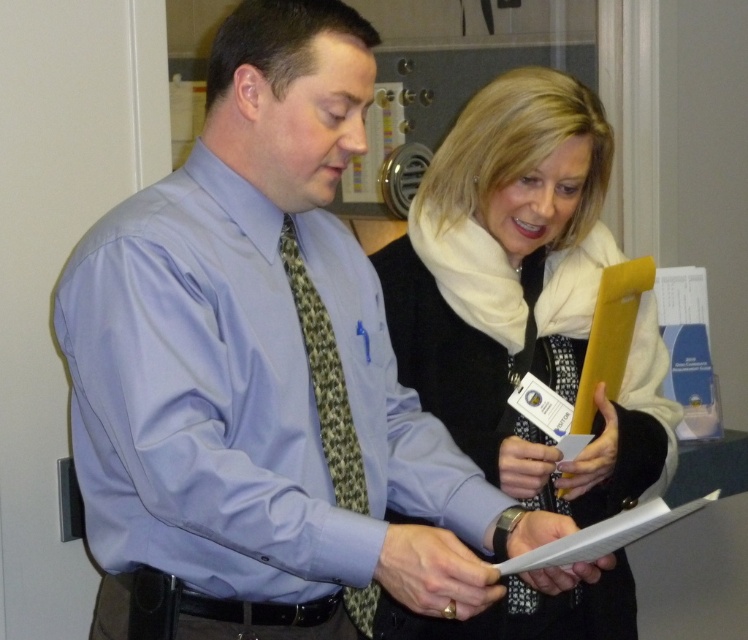
You are an observer standing in front of the two people in the image. Which object is positioned higher up between the white scarf at upper right and the green patterned tie at center?

The white scarf at upper right is located above the green patterned tie at center, so the white scarf at upper right is positioned higher up.

In the scene where two people are discussing documents, there is a point marked at coordinates (524, 296). What object is located at this point?

The point at coordinates (524, 296) indicates the white scarf at upper right.